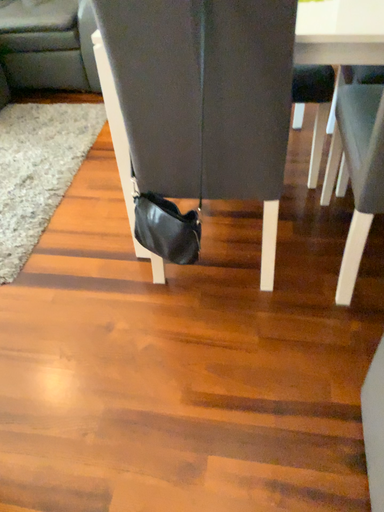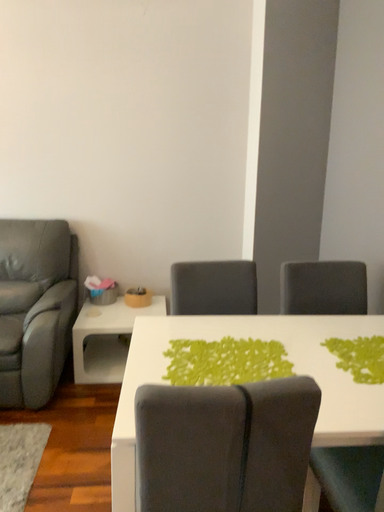
Question: Which way did the camera rotate in the video?

Choices:
 (A) rotated upward
 (B) rotated downward

Answer: (A)